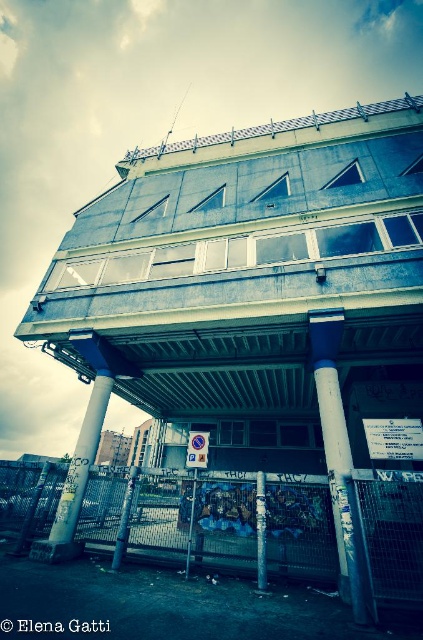
Based on the photo, you are an architect reviewing blueprints and notice two pillars in the building entrance. Which pillar, the white glossy pillar at center or the metallic gray pillar at center, is located to the right of the other?

The white glossy pillar at center is positioned on the right side of the metallic gray pillar at center, so the white glossy pillar at center is to the right of the metallic gray pillar at center.

You are a city planner assessing the space between the blue painted metal pole at center and the metallic gray pillar at center. Based on their sizes, which one would require more space for maintenance access?

The metallic gray pillar at center requires more space for maintenance access because it is larger than the blue painted metal pole at center.

You are a delivery person trying to navigate through the entrance of the building. There are two pillars here, the white glossy pillar at center and the metallic gray pillar at center. The distance between them is crucial for your delivery cart to pass through. Can you estimate if your cart, which is 3 meters wide, can fit through the space between them?

The white glossy pillar at center is 3.17 meters away from the metallic gray pillar at center. Since your cart is 3 meters wide, it should fit comfortably between them as the distance is slightly larger than the cart.